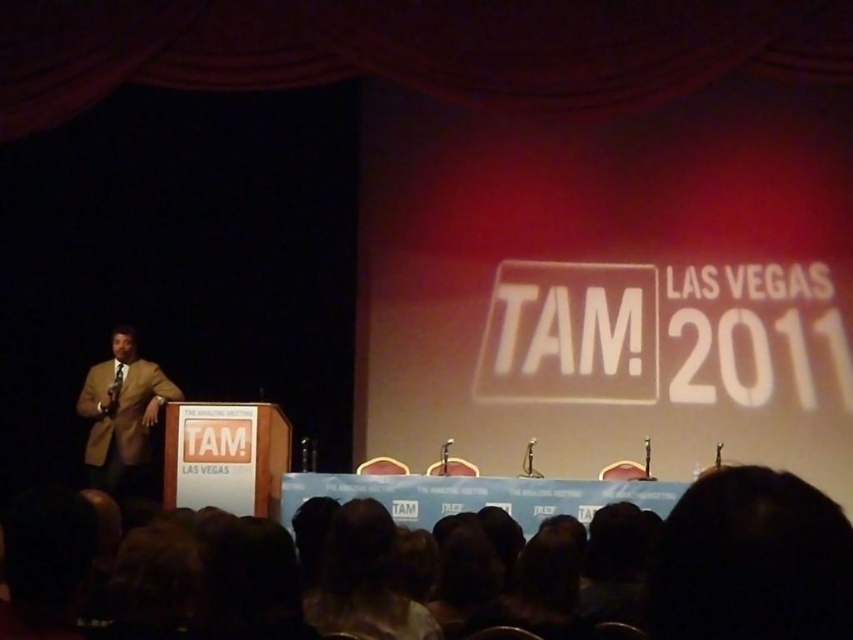
You are an attendee at the TAM conference in Las Vegas 2011. You notice two features on the stage from your seat in the audience. One is the dark hair at lower right and the other is the light brown suit at left. Which one is located to the right side of the other?

The dark hair at lower right is positioned on the right side of the light brown suit at left.

From the picture: You are an attendee at the TAM conference in Las Vegas 2011, standing in the audience. You notice two elements on the stage from your perspective. The first is a dark hair at lower right, and the second is a light brown suit at left. Which of these two elements is shorter in height?

The dark hair at lower right has a lesser height compared to the light brown suit at left, so the dark hair at lower right is shorter in height.